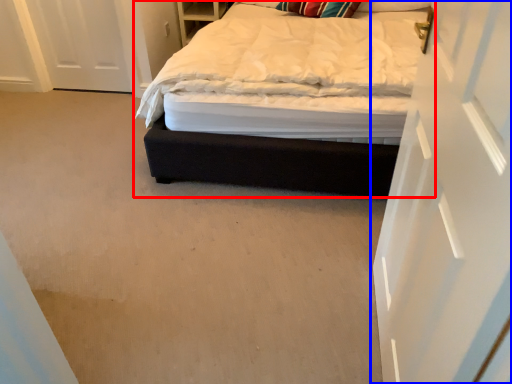
Question: Which of the following is the farthest to the observer, bed (highlighted by a red box) or door (highlighted by a blue box)?

Choices:
 (A) bed
 (B) door

Answer: (A)